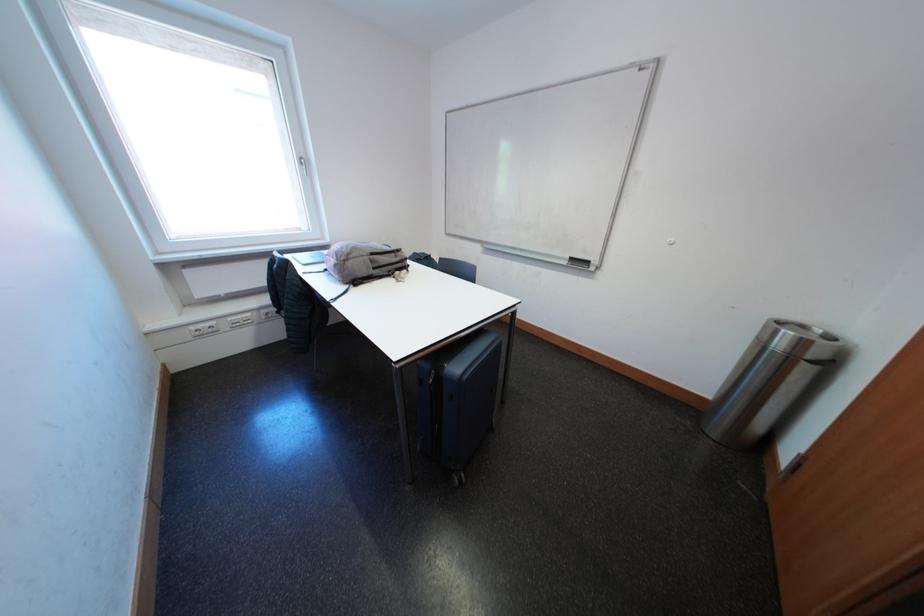
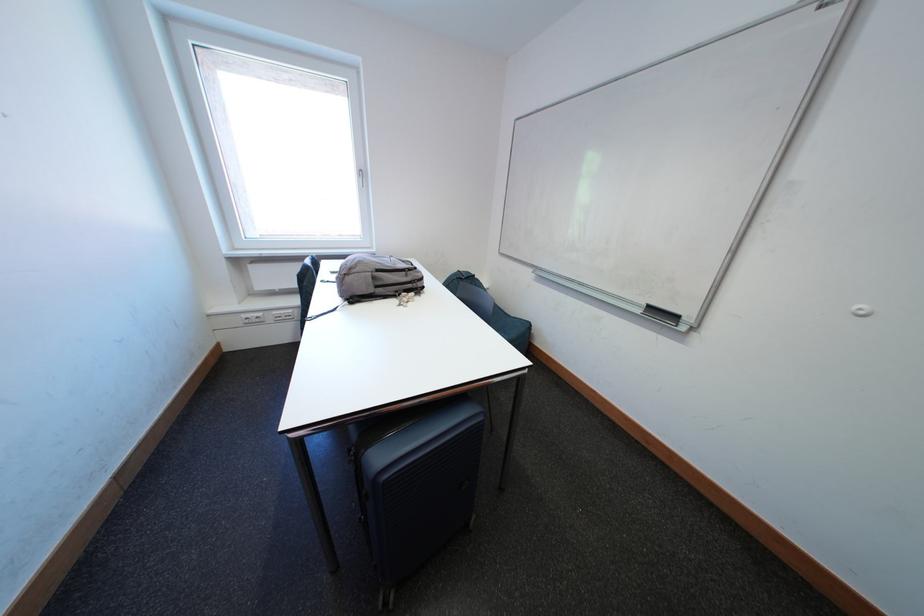
Question: The images are taken continuously from a first-person perspective. In which direction is your viewpoint rotating?

Choices:
 (A) Left
 (B) Right
 (C) Up
 (D) Down

Answer: (A)